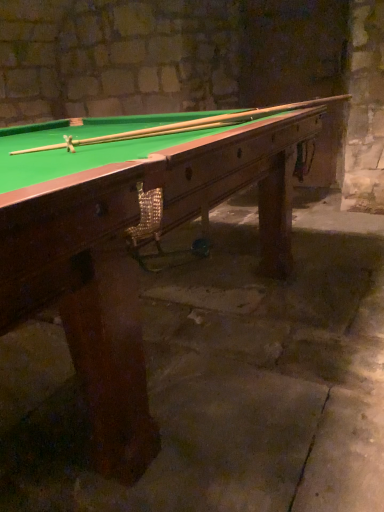
Question: From the image's perspective, is wooden billiard table at center located above or below wooden cue at upper center?

Choices:
 (A) below
 (B) above

Answer: (A)

Question: Looking at the image, does wooden billiard table at center seem bigger or smaller compared to wooden cue at upper center?

Choices:
 (A) big
 (B) small

Answer: (A)

Question: Do you think wooden billiard table at center is within wooden cue at upper center, or outside of it?

Choices:
 (A) inside
 (B) outside

Answer: (B)

Question: Is point (286, 104) positioned closer to the camera than point (76, 242)?

Choices:
 (A) closer
 (B) farther

Answer: (B)

Question: From the image's perspective, relative to wooden billiard table at center, is wooden cue at upper center above or below?

Choices:
 (A) below
 (B) above

Answer: (B)

Question: Is wooden cue at upper center inside the boundaries of wooden billiard table at center, or outside?

Choices:
 (A) inside
 (B) outside

Answer: (A)

Question: Considering the positions of wooden cue at upper center and wooden billiard table at center in the image, is wooden cue at upper center taller or shorter than wooden billiard table at center?

Choices:
 (A) tall
 (B) short

Answer: (B)